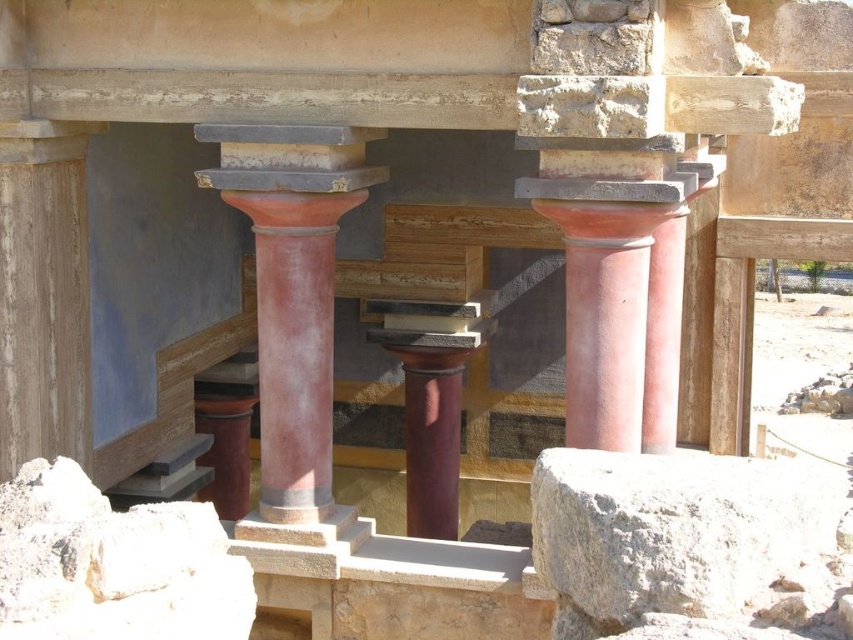
You are an archaeologist examining the ancient structure. You notice the gray rough stone at lower right and the matte terracotta column at center. Which object takes up more area in the scene?

The matte terracotta column at center occupies more space than the gray rough stone at lower right.

You are standing in front of an ancient structure. There are two points marked on the image. The first point is at coordinates point (695, 525) and the second is at point (329, 348). Which point is closer to you?

Point (695, 525) is closer to the viewer than point (329, 348).